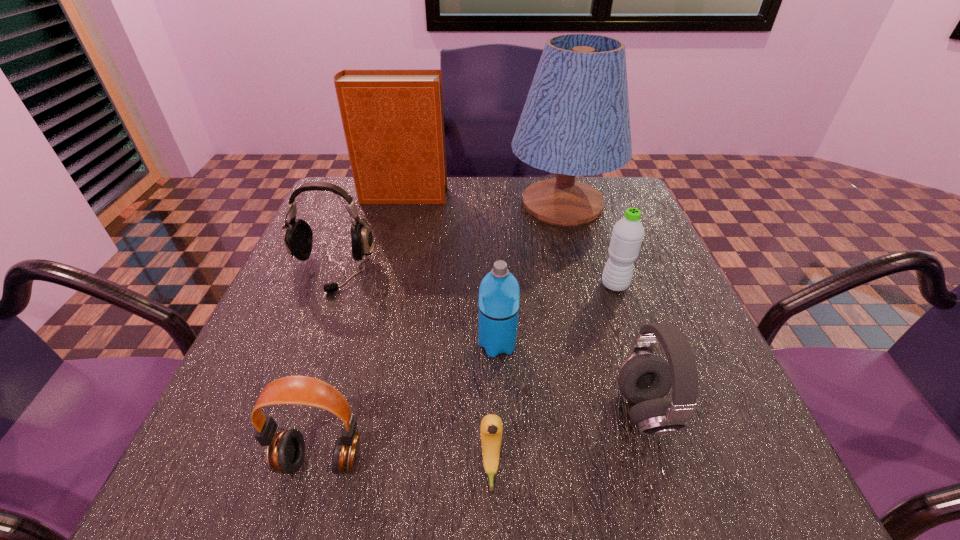
This screenshot has height=540, width=960. What are the coordinates of `vacant region located on the left of the fifth farthest object` in the screenshot? It's located at (309, 345).

Find the location of a particular element. The width and height of the screenshot is (960, 540). vacant space located on the left of the water bottle is located at coordinates (449, 285).

The image size is (960, 540). Find the location of `free location located on the ear cups of the rightmost headset`. free location located on the ear cups of the rightmost headset is located at coordinates (530, 411).

At what (x,y) coordinates should I click in order to perform the action: click on free region located 0.350m on the ear cups of the rightmost headset. Please return your answer as a coordinate pair (x, y). This screenshot has width=960, height=540. Looking at the image, I should click on (x=398, y=411).

Locate an element on the screen. Image resolution: width=960 pixels, height=540 pixels. vacant space located on the ear cups of the rightmost headset is located at coordinates (536, 411).

This screenshot has width=960, height=540. Find the location of `lampshade that is at the far edge`. lampshade that is at the far edge is located at coordinates (575, 122).

The image size is (960, 540). I want to click on hardback book located at the far edge, so click(393, 120).

Identify the location of banana at the near edge. (491, 425).

Where is `hardback book that is at the left edge`? hardback book that is at the left edge is located at coordinates (393, 120).

Image resolution: width=960 pixels, height=540 pixels. In order to click on lampshade present at the right edge in this screenshot , I will do `click(575, 122)`.